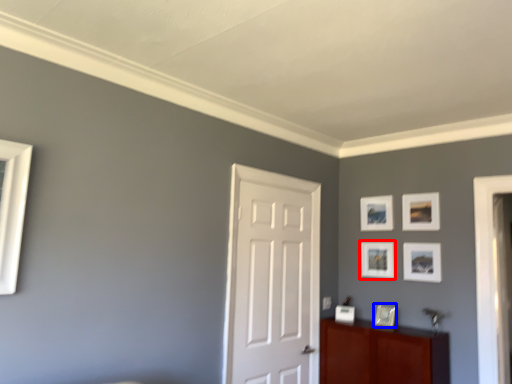
Question: Which of the following is the farthest to the observer, picture frame (highlighted by a red box) or picture frame (highlighted by a blue box)?

Choices:
 (A) picture frame
 (B) picture frame

Answer: (A)